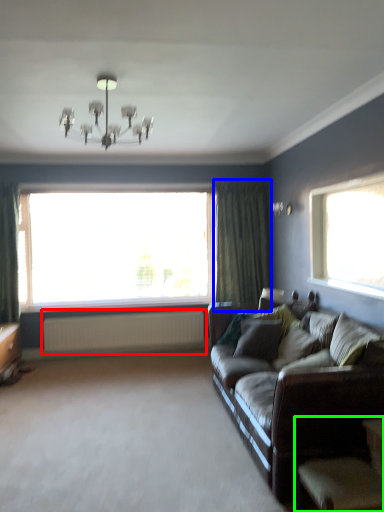
Question: Which object is positioned closest to radiator (highlighted by a red box)? Select from curtain (highlighted by a blue box) and armchair (highlighted by a green box).

Choices:
 (A) curtain
 (B) armchair

Answer: (A)